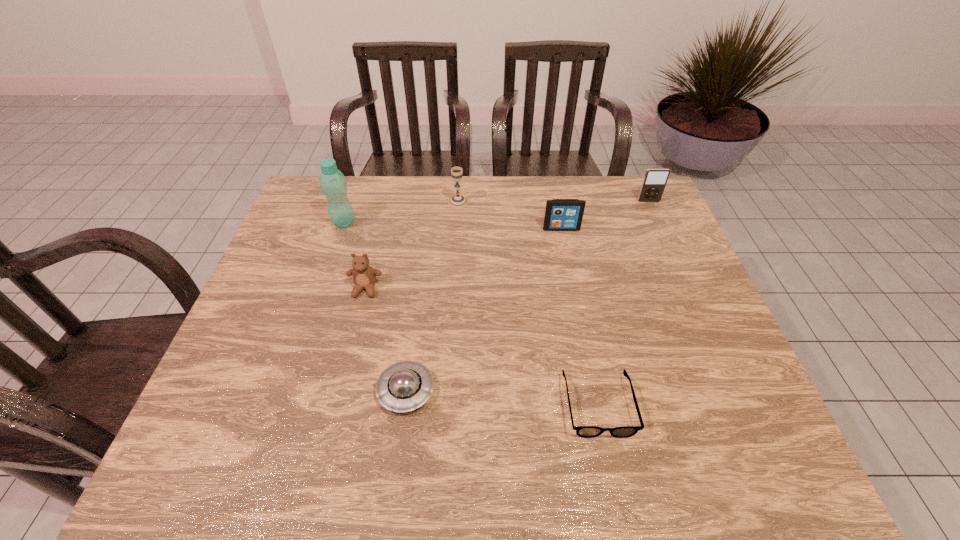
The width and height of the screenshot is (960, 540). In order to click on bottle in this screenshot , I will do `click(333, 184)`.

This screenshot has width=960, height=540. I want to click on the leftmost object, so click(x=333, y=184).

I want to click on chalice, so click(x=457, y=201).

Identify the location of the farther iPod. This screenshot has height=540, width=960. (655, 180).

Locate an element on the screen. This screenshot has width=960, height=540. the rightmost object is located at coordinates (655, 180).

Locate an element on the screen. This screenshot has width=960, height=540. the second object from left to right is located at coordinates (364, 276).

Locate an element on the screen. This screenshot has height=540, width=960. teddy bear is located at coordinates tap(364, 276).

You are a GUI agent. You are given a task and a screenshot of the screen. Output one action in this format:
    pyautogui.click(x=<x>, y=<y>)
    Task: Click on the nearer iPod
    The width and height of the screenshot is (960, 540).
    Given the screenshot: What is the action you would take?
    pyautogui.click(x=560, y=214)

The image size is (960, 540). What are the coordinates of `saucer` in the screenshot? It's located at (406, 385).

At what (x,y) coordinates should I click in order to perform the action: click on spectacles. Please return your answer as a coordinate pair (x, y). This screenshot has height=540, width=960. Looking at the image, I should click on (582, 431).